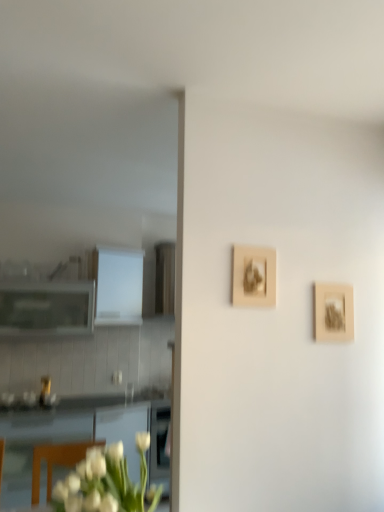
Question: Considering the relative positions of white glossy cabinet at left, which appears as the 2th cabinetry when viewed from the left, and matte white cabinet at left, marked as the 1th cabinetry in a left-to-right arrangement, in the image provided, is white glossy cabinet at left, which appears as the 2th cabinetry when viewed from the left, behind matte white cabinet at left, marked as the 1th cabinetry in a left-to-right arrangement,?

Choices:
 (A) no
 (B) yes

Answer: (B)

Question: Is matte white cabinet at left, marked as the 1th cabinetry in a left-to-right arrangement, surrounded by white glossy cabinet at left, acting as the first cabinetry starting from the right?

Choices:
 (A) no
 (B) yes

Answer: (A)

Question: From a real-world perspective, does white glossy cabinet at left, acting as the first cabinetry starting from the right, stand above matte white cabinet at left, marked as the 1th cabinetry in a left-to-right arrangement?

Choices:
 (A) yes
 (B) no

Answer: (A)

Question: From the image's perspective, is white glossy cabinet at left, which appears as the 2th cabinetry when viewed from the left, on matte white cabinet at left, acting as the second cabinetry starting from the right?

Choices:
 (A) yes
 (B) no

Answer: (A)

Question: Is white glossy cabinet at left, acting as the first cabinetry starting from the right, shorter than matte white cabinet at left, acting as the second cabinetry starting from the right?

Choices:
 (A) no
 (B) yes

Answer: (A)

Question: Can you confirm if white glossy cabinet at left, which appears as the 2th cabinetry when viewed from the left, is positioned to the left of matte white cabinet at left, marked as the 1th cabinetry in a left-to-right arrangement?

Choices:
 (A) yes
 (B) no

Answer: (B)

Question: From the image's perspective, is wooden frame at right, which is counted as the second picture frame, starting from the left, on white glossy cabinet at left, acting as the first cabinetry starting from the right?

Choices:
 (A) no
 (B) yes

Answer: (B)

Question: Is wooden frame at right, which is counted as the second picture frame, starting from the left, shorter than white glossy cabinet at left, which appears as the 2th cabinetry when viewed from the left?

Choices:
 (A) no
 (B) yes

Answer: (B)

Question: Considering the relative positions of wooden frame at right, positioned as the 1th picture frame in right-to-left order, and white glossy cabinet at left, acting as the first cabinetry starting from the right, in the image provided, is wooden frame at right, positioned as the 1th picture frame in right-to-left order, to the left of white glossy cabinet at left, acting as the first cabinetry starting from the right, from the viewer's perspective?

Choices:
 (A) no
 (B) yes

Answer: (A)

Question: Considering the relative positions of wooden frame at right, the 2th picture frame in the front-to-back sequence, and white glossy cabinet at left, acting as the first cabinetry starting from the right, in the image provided, is wooden frame at right, the 2th picture frame in the front-to-back sequence, to the right of white glossy cabinet at left, acting as the first cabinetry starting from the right, from the viewer's perspective?

Choices:
 (A) yes
 (B) no

Answer: (A)

Question: Is wooden frame at right, the first picture frame from the back, further to camera compared to white glossy cabinet at left, acting as the first cabinetry starting from the right?

Choices:
 (A) no
 (B) yes

Answer: (A)

Question: From a real-world perspective, is wooden frame at right, the first picture frame from the back, on white glossy cabinet at left, which appears as the 2th cabinetry when viewed from the left?

Choices:
 (A) yes
 (B) no

Answer: (B)

Question: From a real-world perspective, is wooden frame at right, which is counted as the second picture frame, starting from the left, located higher than white matte flower at lower left?

Choices:
 (A) no
 (B) yes

Answer: (B)